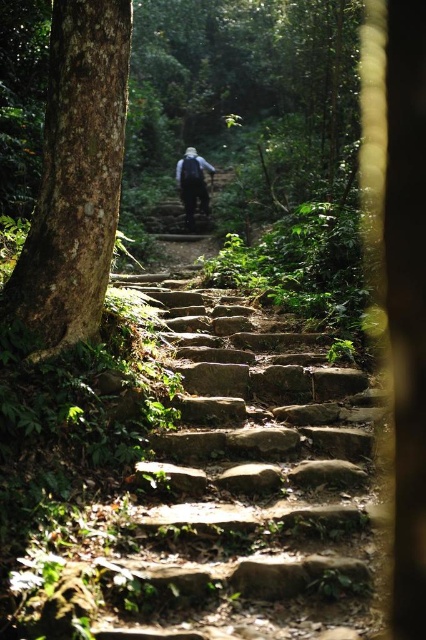
What do you see at coordinates (74, 179) in the screenshot? I see `smooth brown tree trunk at left` at bounding box center [74, 179].

Locate an element on the screen. smooth brown tree trunk at left is located at coordinates pyautogui.click(x=74, y=179).

This screenshot has width=426, height=640. What do you see at coordinates (255, 492) in the screenshot?
I see `natural stone stairs at center` at bounding box center [255, 492].

You are a GUI agent. You are given a task and a screenshot of the screen. Output one action in this format:
    pyautogui.click(x=<x>, y=<y>)
    Task: Click on the natural stone stairs at center
    Image resolution: width=426 pixels, height=640 pixels.
    Given the screenshot: What is the action you would take?
    pyautogui.click(x=255, y=492)

Based on the photo, is natural stone stairs at center behind dark blue fabric backpack at center?

No, it is in front of dark blue fabric backpack at center.

Is point (288, 417) less distant than point (195, 179)?

Yes, point (288, 417) is closer to viewer.

You are a GUI agent. You are given a task and a screenshot of the screen. Output one action in this format:
    pyautogui.click(x=<x>, y=<y>)
    Task: Click on the natural stone stairs at center
    The height and width of the screenshot is (640, 426).
    Given the screenshot: What is the action you would take?
    pyautogui.click(x=255, y=492)